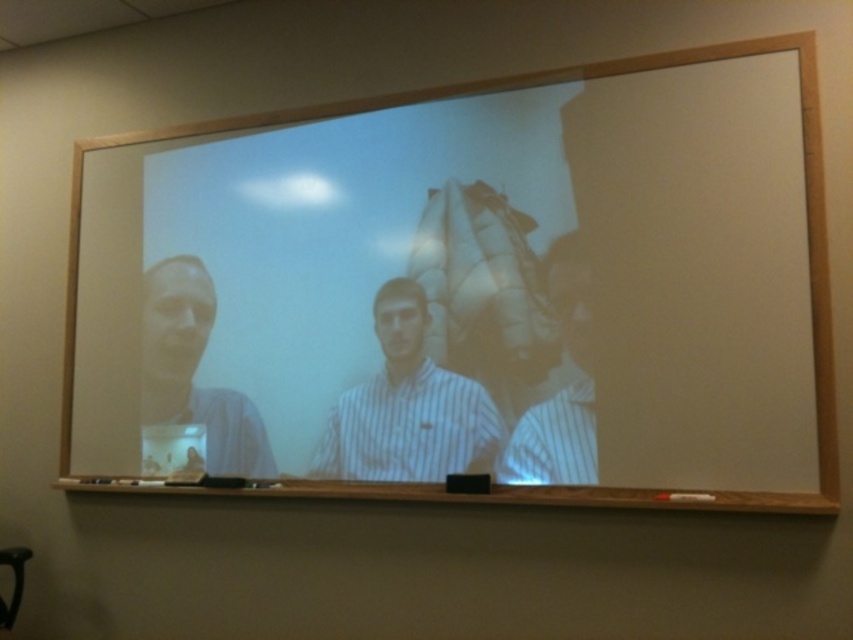
You are organizing a classroom and need to place a new projector. The projector needs to be positioned so that its beam can reach both the wooden frame at center and the matte plastic cup at left. Given their positions, which object should the projector be aligned towards first to ensure both are within the projection area?

The wooden frame at center is to the right of the matte plastic cup at left. To ensure both are within the projection area, the projector should first be aligned towards the matte plastic cup at left, as it is the leftmost object, allowing the beam to cover the wider span from left to right to include both objects.

You are a photographer trying to capture a clear image of the white striped shirt at center and the matte plastic cup at left. Which object should you focus on to ensure it appears larger in your photo?

The white striped shirt at center should be focused on because its width is larger than the matte plastic cup at left, making it the better choice for a larger appearance in the photo.